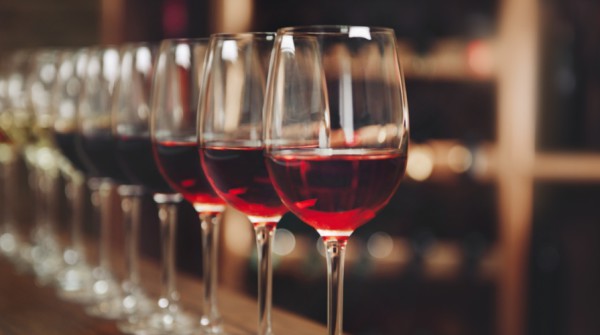
This screenshot has height=335, width=600. Find the location of `wine glasses`. wine glasses is located at coordinates click(301, 68), click(198, 70), click(231, 80), click(142, 83), click(105, 64), click(76, 209), click(49, 194), click(6, 196), click(130, 201).